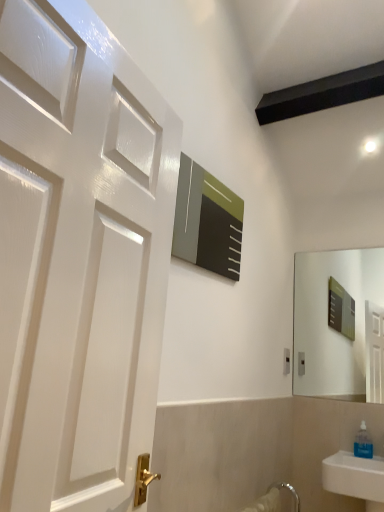
Where is `transparent plastic soap dispenser at lower right`? transparent plastic soap dispenser at lower right is located at coordinates (363, 443).

Measure the distance between transparent plastic soap dispenser at lower right and camera.

The distance of transparent plastic soap dispenser at lower right from camera is 7.18 feet.

Describe the element at coordinates (363, 443) in the screenshot. I see `transparent plastic soap dispenser at lower right` at that location.

Identify the location of white plastic electric outlet at upper right. (286, 361).

The height and width of the screenshot is (512, 384). What do you see at coordinates (286, 361) in the screenshot? I see `white plastic electric outlet at upper right` at bounding box center [286, 361].

In order to face white plastic electric outlet at upper right, should I rotate leftwards or rightwards?

Rotate your view right by about 12.871°.

Find the location of `transparent plastic soap dispenser at lower right`. transparent plastic soap dispenser at lower right is located at coordinates (363, 443).

Considering the positions of objects transparent plastic soap dispenser at lower right and white plastic electric outlet at upper right in the image provided, who is more to the right, transparent plastic soap dispenser at lower right or white plastic electric outlet at upper right?

transparent plastic soap dispenser at lower right is more to the right.

Consider the image. Considering their positions, is transparent plastic soap dispenser at lower right located in front of or behind white plastic electric outlet at upper right?

transparent plastic soap dispenser at lower right is in front of white plastic electric outlet at upper right.

Considering the positions of point (363, 433) and point (285, 351), is point (363, 433) closer or farther from the camera than point (285, 351)?

Point (363, 433) is closer to the camera than point (285, 351).

From the image's perspective, is transparent plastic soap dispenser at lower right above or below white plastic electric outlet at upper right?

transparent plastic soap dispenser at lower right is below white plastic electric outlet at upper right.

From a real-world perspective, is transparent plastic soap dispenser at lower right physically located above or below white plastic electric outlet at upper right?

From a real-world perspective, transparent plastic soap dispenser at lower right is physically below white plastic electric outlet at upper right.

Between transparent plastic soap dispenser at lower right and white plastic electric outlet at upper right, which one has smaller width?

With smaller width is white plastic electric outlet at upper right.

Which of these two, transparent plastic soap dispenser at lower right or white plastic electric outlet at upper right, stands taller?

transparent plastic soap dispenser at lower right is taller.

Considering the sizes of objects transparent plastic soap dispenser at lower right and white plastic electric outlet at upper right in the image provided, who is smaller, transparent plastic soap dispenser at lower right or white plastic electric outlet at upper right?

With smaller size is white plastic electric outlet at upper right.

Is transparent plastic soap dispenser at lower right surrounding white plastic electric outlet at upper right?

That's incorrect, white plastic electric outlet at upper right is not inside transparent plastic soap dispenser at lower right.

Is transparent plastic soap dispenser at lower right directly adjacent to white plastic electric outlet at upper right?

There is a gap between transparent plastic soap dispenser at lower right and white plastic electric outlet at upper right.

Does transparent plastic soap dispenser at lower right turn towards white plastic electric outlet at upper right?

No, transparent plastic soap dispenser at lower right is not turned towards white plastic electric outlet at upper right.

Find the location of `soap dispenser in front of the white plastic electric outlet at upper right`. soap dispenser in front of the white plastic electric outlet at upper right is located at coordinates (363, 443).

Which object is positioned more to the left, white plastic electric outlet at upper right or transparent plastic soap dispenser at lower right?

From the viewer's perspective, white plastic electric outlet at upper right appears more on the left side.

Is the depth of white plastic electric outlet at upper right greater than that of transparent plastic soap dispenser at lower right?

Yes, white plastic electric outlet at upper right is further from the camera.

Does point (286, 359) come farther from viewer compared to point (369, 445)?

Yes.

From the image's perspective, between white plastic electric outlet at upper right and transparent plastic soap dispenser at lower right, who is located below?

From the image's view, transparent plastic soap dispenser at lower right is below.

From a real-world perspective, is white plastic electric outlet at upper right located beneath transparent plastic soap dispenser at lower right?

Actually, white plastic electric outlet at upper right is physically above transparent plastic soap dispenser at lower right in the real world.

Is white plastic electric outlet at upper right wider or thinner than transparent plastic soap dispenser at lower right?

white plastic electric outlet at upper right is thinner than transparent plastic soap dispenser at lower right.

Considering the sizes of white plastic electric outlet at upper right and transparent plastic soap dispenser at lower right in the image, is white plastic electric outlet at upper right taller or shorter than transparent plastic soap dispenser at lower right?

Clearly, white plastic electric outlet at upper right is shorter compared to transparent plastic soap dispenser at lower right.

From the picture: Who is smaller, white plastic electric outlet at upper right or transparent plastic soap dispenser at lower right?

white plastic electric outlet at upper right is smaller.

Would you say white plastic electric outlet at upper right is inside or outside transparent plastic soap dispenser at lower right?

white plastic electric outlet at upper right exists outside the volume of transparent plastic soap dispenser at lower right.

Is the surface of white plastic electric outlet at upper right in direct contact with transparent plastic soap dispenser at lower right?

No, white plastic electric outlet at upper right is not touching transparent plastic soap dispenser at lower right.

Is white plastic electric outlet at upper right turned away from transparent plastic soap dispenser at lower right?

No, white plastic electric outlet at upper right is not facing away from transparent plastic soap dispenser at lower right.

I want to click on soap dispenser that appears in front of the white plastic electric outlet at upper right, so click(x=363, y=443).

This screenshot has width=384, height=512. I want to click on electric outlet above the transparent plastic soap dispenser at lower right (from a real-world perspective), so click(286, 361).

I want to click on soap dispenser that is under the white plastic electric outlet at upper right (from a real-world perspective), so click(x=363, y=443).